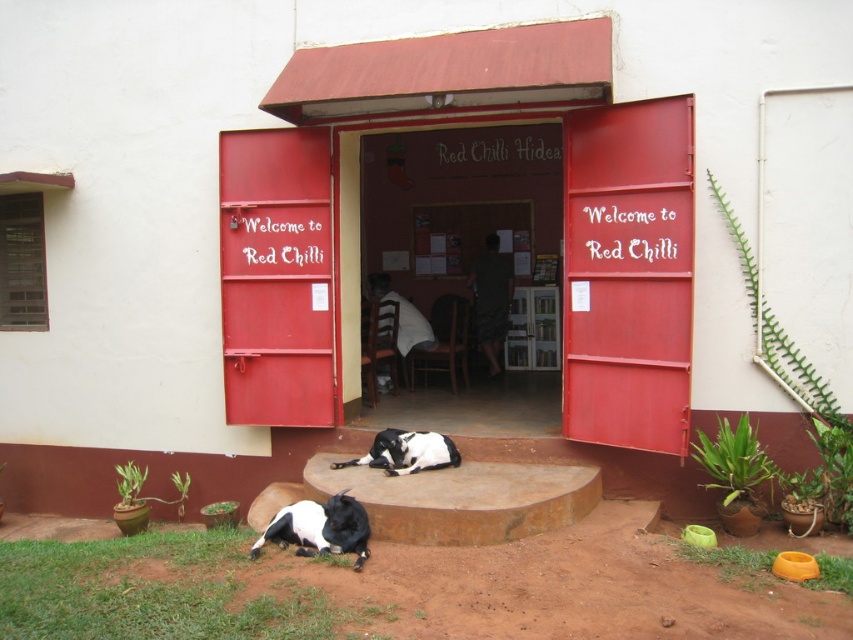
Question: Considering the real-world distances, which object is closest to the black and white fur dog at lower center?

Choices:
 (A) brown wooden door at center
 (B) black and white fur at lower left

Answer: (B)

Question: Does brown wooden door at center have a greater width compared to black and white fur dog at lower center?

Choices:
 (A) yes
 (B) no

Answer: (A)

Question: Among these points, which one is nearest to the camera?

Choices:
 (A) (379, 445)
 (B) (368, 268)

Answer: (A)

Question: Does brown wooden door at center lie behind black and white fur dog at lower center?

Choices:
 (A) yes
 (B) no

Answer: (A)

Question: Which object is the farthest from the black and white fur dog at lower center?

Choices:
 (A) black and white fur at lower left
 (B) brown wooden door at center

Answer: (B)

Question: Does brown wooden door at center have a smaller size compared to black and white fur dog at lower center?

Choices:
 (A) no
 (B) yes

Answer: (A)